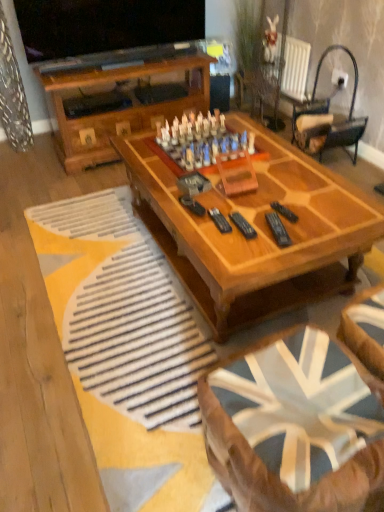
Question: Can you confirm if wooden coffee table at center, which is counted as the second coffee table, starting from the back, is taller than black metal/wooden rocking chair at upper right?

Choices:
 (A) yes
 (B) no

Answer: (B)

Question: Does wooden coffee table at center, which is the first coffee table from front to back, have a lesser height compared to black metal/wooden rocking chair at upper right?

Choices:
 (A) yes
 (B) no

Answer: (A)

Question: Does wooden coffee table at center, which is counted as the second coffee table, starting from the back, appear on the right side of black metal/wooden rocking chair at upper right?

Choices:
 (A) no
 (B) yes

Answer: (A)

Question: Is wooden coffee table at center, which is counted as the second coffee table, starting from the back, oriented away from black metal/wooden rocking chair at upper right?

Choices:
 (A) no
 (B) yes

Answer: (A)

Question: From the image's perspective, is wooden coffee table at center, placed as the 2th coffee table when sorted from top to bottom, below black metal/wooden rocking chair at upper right?

Choices:
 (A) no
 (B) yes

Answer: (B)

Question: Is the depth of wooden coffee table at center, which is the first coffee table from front to back, greater than that of black metal/wooden rocking chair at upper right?

Choices:
 (A) yes
 (B) no

Answer: (B)

Question: Does black plastic remote at center, positioned as the first remote in right-to-left order, touch wooden coffee table at center, which is counted as the 1th coffee table, starting from the back?

Choices:
 (A) no
 (B) yes

Answer: (A)

Question: Could wooden coffee table at center, which appears as the 2th coffee table when viewed from the front, be considered to be inside black plastic remote at center, the 3th remote viewed from the left?

Choices:
 (A) no
 (B) yes

Answer: (A)

Question: From a real-world perspective, is black plastic remote at center, the 3th remote viewed from the left, over wooden coffee table at center, the 1th coffee table from the top?

Choices:
 (A) yes
 (B) no

Answer: (A)

Question: From the image's perspective, is black plastic remote at center, positioned as the first remote in right-to-left order, beneath wooden coffee table at center, which appears as the 2th coffee table when viewed from the front?

Choices:
 (A) yes
 (B) no

Answer: (A)

Question: Does black plastic remote at center, the 3th remote viewed from the left, have a lesser height compared to wooden coffee table at center, the 1th coffee table from the top?

Choices:
 (A) yes
 (B) no

Answer: (A)

Question: Does black plastic remote at center, the 3th remote viewed from the left, turn towards wooden coffee table at center, the 1th coffee table from the top?

Choices:
 (A) yes
 (B) no

Answer: (B)

Question: From the image's perspective, would you say black plastic remote at center, which is the 2th remote in left-to-right order, is positioned over wooden chess set at center?

Choices:
 (A) no
 (B) yes

Answer: (A)